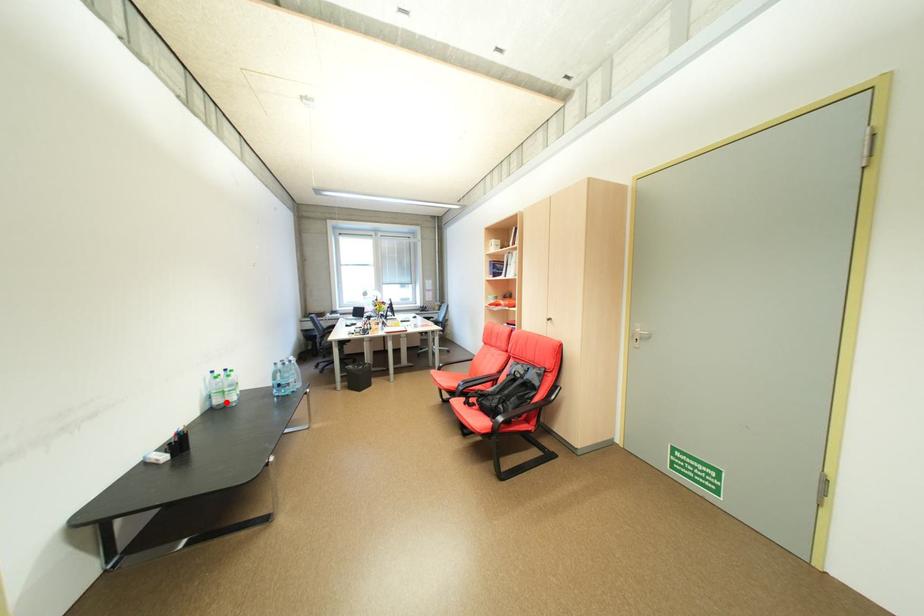
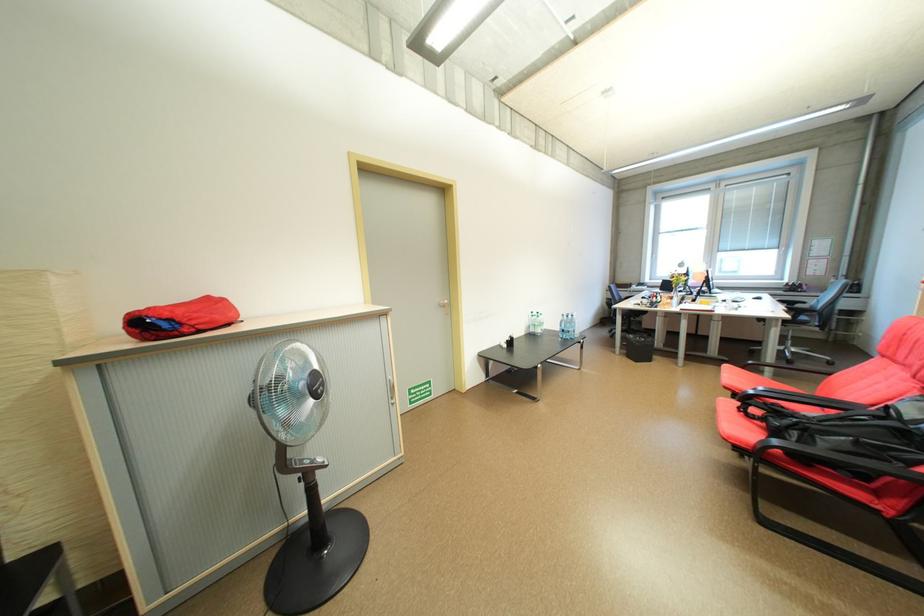
Question: I am providing you with two images of the same scene from different viewpoints. Given a red point in image1, look at the same physical point in image2. Is it:

Choices:
 (A) Closer to the viewpoint
 (B) Farther from the viewpoint

Answer: (B)